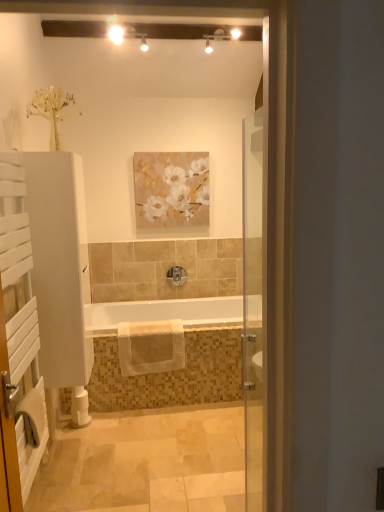
Question: Choose the correct answer: Is white soft towel at lower left, the 2th bath towel from the back, inside matte floral painting at upper center or outside it?

Choices:
 (A) outside
 (B) inside

Answer: (A)

Question: Visually, is white soft towel at lower left, the first bath towel viewed from the front, positioned to the left or to the right of matte floral painting at upper center?

Choices:
 (A) right
 (B) left

Answer: (B)

Question: Which object is positioned farthest from the white wooden towel rack at left?

Choices:
 (A) white soft towel at lower left, the first bath towel viewed from the front
 (B) beige textured towel at center, which ranks as the 1th bath towel in right-to-left order
 (C) white glossy bathtub at center
 (D) polished chrome faucet at center
 (E) matte floral painting at upper center

Answer: (D)

Question: Estimate the real-world distances between objects in this image. Which object is closer to the white wooden towel rack at left?

Choices:
 (A) white soft towel at lower left, the first bath towel viewed from the front
 (B) white glossy bathtub at center
 (C) polished chrome faucet at center
 (D) matte floral painting at upper center
 (E) beige textured towel at center, which is counted as the 1th bath towel, starting from the back

Answer: (A)